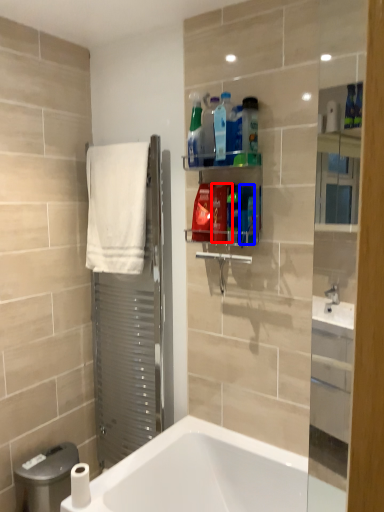
Question: Which of the following is the farthest to the observer, cleaning product (highlighted by a red box) or cleaning product (highlighted by a blue box)?

Choices:
 (A) cleaning product
 (B) cleaning product

Answer: (A)